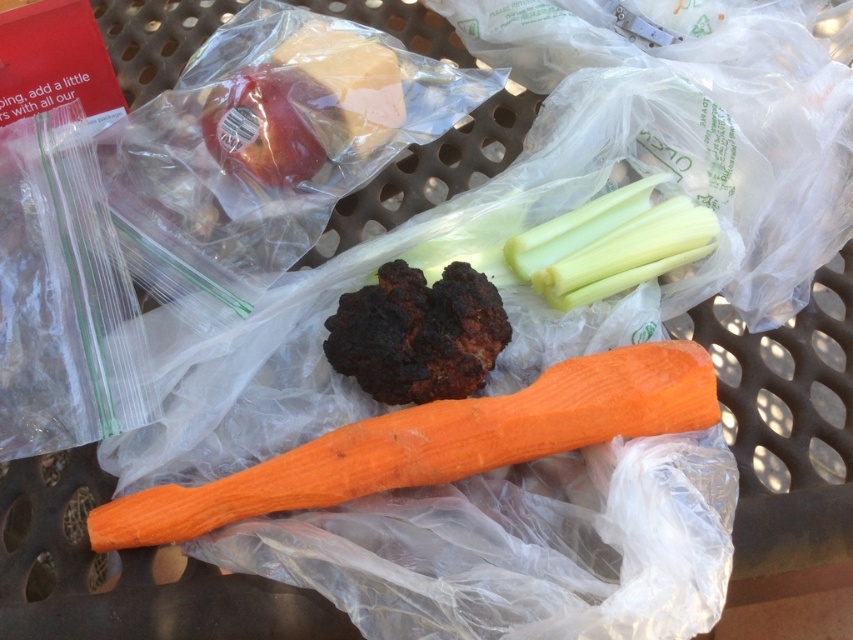
Question: Based on their relative distances, which object is nearer to the orange smooth carrot at center?

Choices:
 (A) red matte apple at upper left
 (B) charcoal-baked chicken at center

Answer: (B)

Question: Based on their relative distances, which object is farther from the charcoal-baked chicken at center?

Choices:
 (A) red matte apple at upper left
 (B) orange smooth carrot at center

Answer: (A)

Question: Can you confirm if charcoal-baked chicken at center is wider than red matte apple at upper left?

Choices:
 (A) yes
 (B) no

Answer: (A)

Question: In this image, where is charcoal-baked chicken at center located relative to red matte apple at upper left?

Choices:
 (A) left
 (B) right

Answer: (B)

Question: Which point is closer to the camera?

Choices:
 (A) red matte apple at upper left
 (B) orange smooth carrot at center

Answer: (B)

Question: Is charcoal-baked chicken at center thinner than red matte apple at upper left?

Choices:
 (A) no
 (B) yes

Answer: (A)